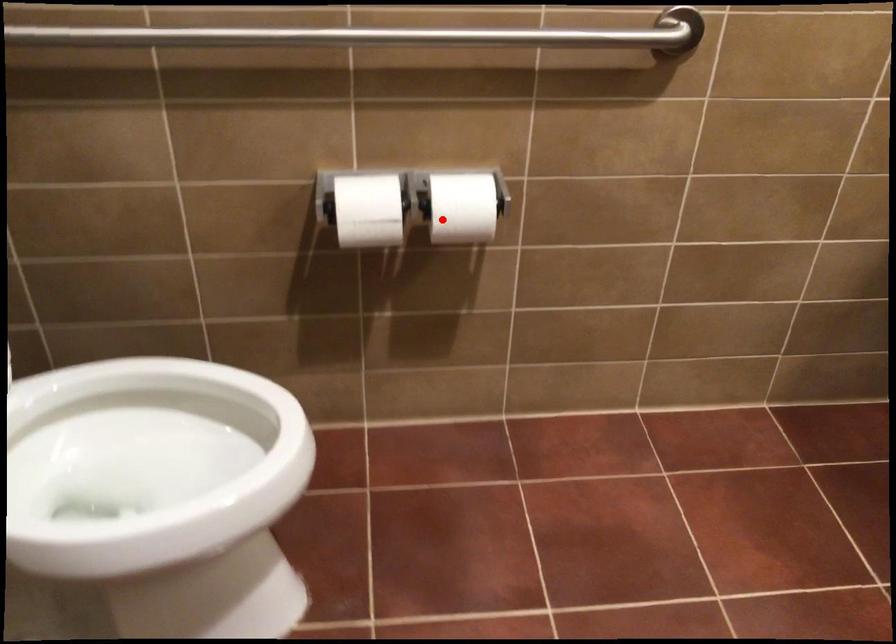
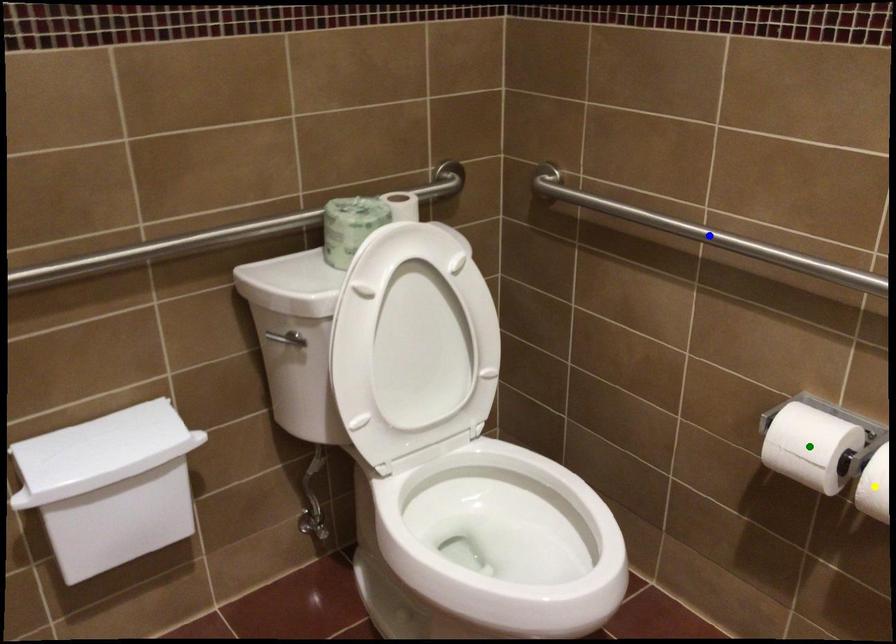
Question: I am providing you with two images of the same scene from different viewpoints. A red point is marked on the first image. You are given multiple points on the second image. In image 2, which mark is for the same physical point as the one in image 1?

Choices:
 (A) yellow point
 (B) green point
 (C) blue point

Answer: (A)